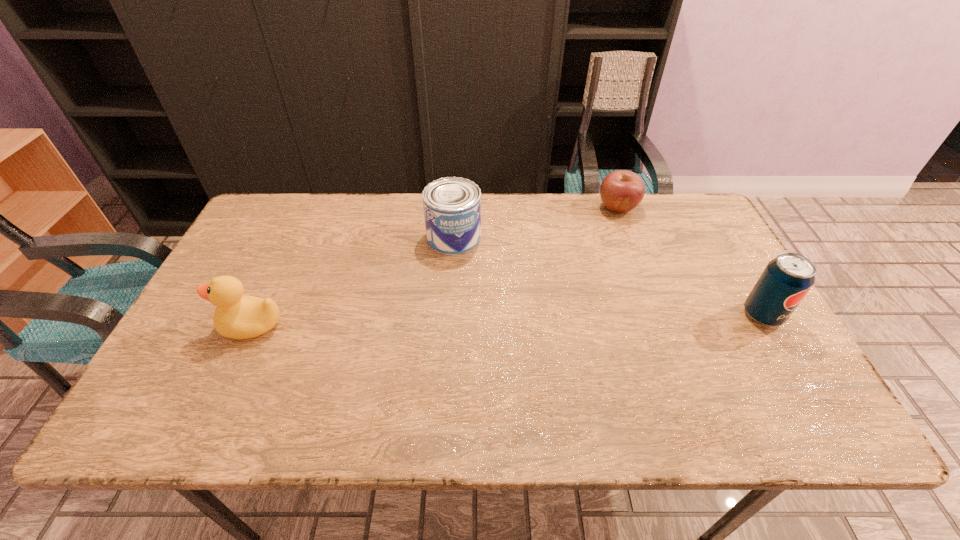
This screenshot has width=960, height=540. Find the location of `vacant space situated 0.360m on the front label of the can`. vacant space situated 0.360m on the front label of the can is located at coordinates (435, 359).

Where is `blank area located 0.240m on the front label of the can`? The image size is (960, 540). blank area located 0.240m on the front label of the can is located at coordinates (441, 319).

I want to click on free space located 0.150m on the front label of the can, so click(445, 293).

The width and height of the screenshot is (960, 540). Identify the location of apple that is at the far edge. (621, 191).

The image size is (960, 540). Find the location of `can present at the far edge`. can present at the far edge is located at coordinates (452, 205).

Locate an element on the screen. This screenshot has height=540, width=960. object that is at the left edge is located at coordinates 237,316.

Where is `object that is positioned at the right edge`? Image resolution: width=960 pixels, height=540 pixels. object that is positioned at the right edge is located at coordinates (785, 281).

In the image, there is a desktop. Identify the location of blank space at the far edge. The image size is (960, 540). (620, 230).

Where is `vacant space at the near edge`? The image size is (960, 540). vacant space at the near edge is located at coordinates (294, 362).

The width and height of the screenshot is (960, 540). I want to click on vacant area at the left edge, so click(261, 261).